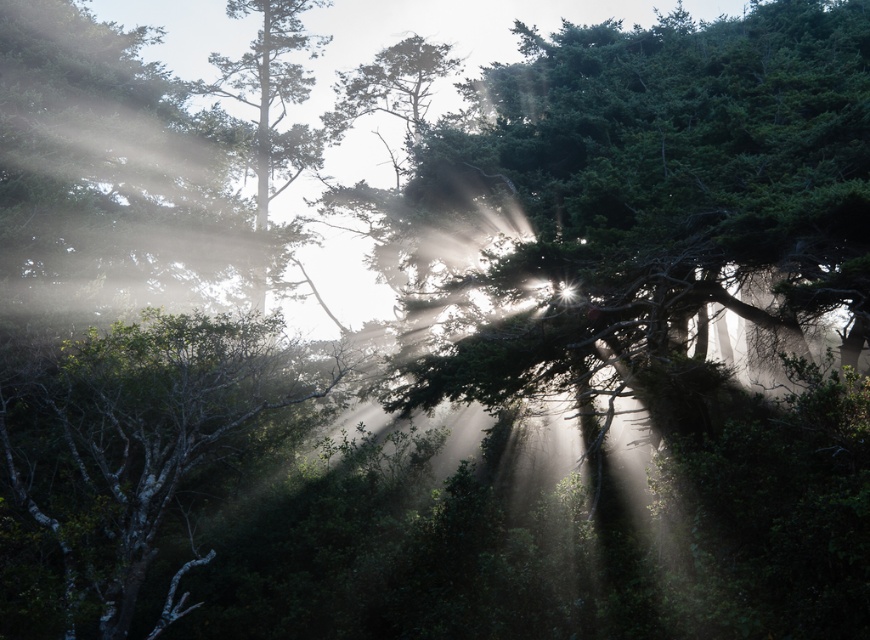
Question: Does green matte tree at upper left have a greater width compared to green matte tree at center?

Choices:
 (A) yes
 (B) no

Answer: (A)

Question: Does green matte tree at upper left have a smaller size compared to green matte tree at lower left?

Choices:
 (A) no
 (B) yes

Answer: (A)

Question: Which point is closer to the camera?

Choices:
 (A) green matte tree at center
 (B) green matte tree at upper left
 (C) green matte tree at lower left

Answer: (C)

Question: Does green matte tree at upper left have a lesser width compared to green matte tree at center?

Choices:
 (A) no
 (B) yes

Answer: (A)

Question: Among these objects, which one is nearest to the camera?

Choices:
 (A) green matte tree at center
 (B) green matte tree at lower left
 (C) green matte tree at upper left

Answer: (B)

Question: Which object is the closest to the green matte tree at upper left?

Choices:
 (A) green matte tree at lower left
 (B) green matte tree at center

Answer: (B)